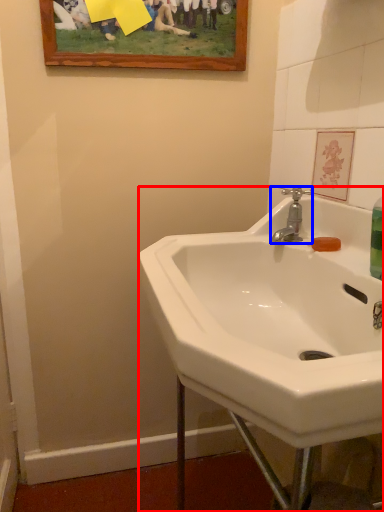
Question: Which point is closer to the camera, sink (highlighted by a red box) or tap (highlighted by a blue box)?

Choices:
 (A) sink
 (B) tap

Answer: (A)